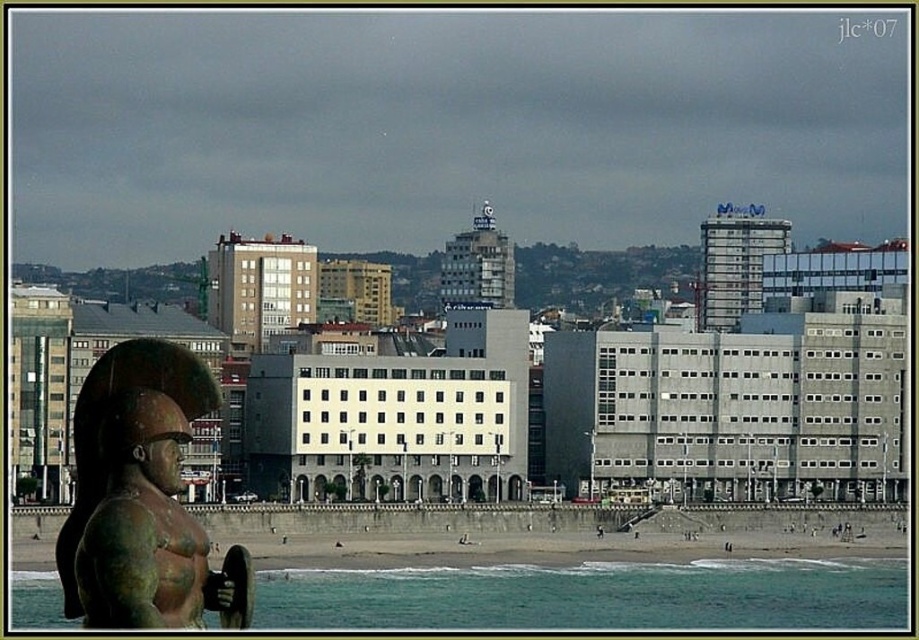
Question: Is greenish-blue water at lower left to the right of bronze statue at left from the viewer's perspective?

Choices:
 (A) yes
 (B) no

Answer: (A)

Question: Is greenish-blue water at lower left above bronze statue at left?

Choices:
 (A) yes
 (B) no

Answer: (B)

Question: Which point appears closest to the camera in this image?

Choices:
 (A) (814, 609)
 (B) (119, 356)

Answer: (B)

Question: Is greenish-blue water at lower left positioned behind bronze statue at left?

Choices:
 (A) yes
 (B) no

Answer: (A)